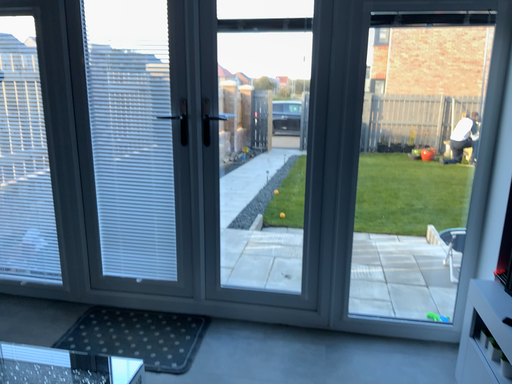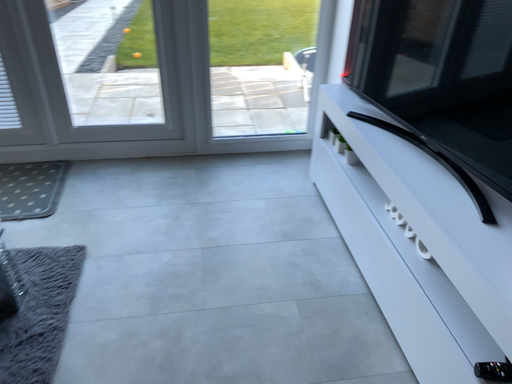
Question: Which way did the camera rotate in the video?

Choices:
 (A) rotated right
 (B) rotated left

Answer: (A)